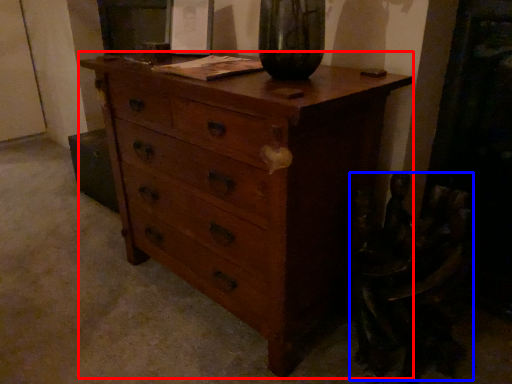
Question: Which object appears closest to the camera in this image, chest of drawers (highlighted by a red box) or swivel chair (highlighted by a blue box)?

Choices:
 (A) chest of drawers
 (B) swivel chair

Answer: (A)